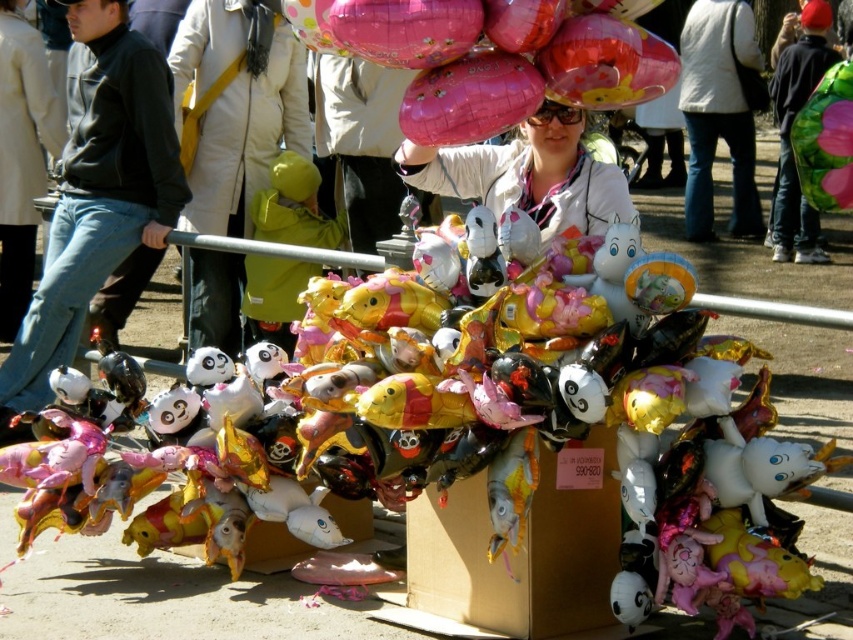
Which of these two, gold cardboard box at center or pink metallic balloon at upper right, stands taller?

Standing taller between the two is pink metallic balloon at upper right.

Does gold cardboard box at center have a larger size compared to pink metallic balloon at upper right?

Incorrect, gold cardboard box at center is not larger than pink metallic balloon at upper right.

The height and width of the screenshot is (640, 853). Describe the element at coordinates (521, 547) in the screenshot. I see `gold cardboard box at center` at that location.

Find the location of a particular element. gold cardboard box at center is located at coordinates (521, 547).

Can you confirm if gold cardboard box at center is smaller than metallic gold balloon at center?

Yes, gold cardboard box at center is smaller than metallic gold balloon at center.

What do you see at coordinates (521, 547) in the screenshot?
I see `gold cardboard box at center` at bounding box center [521, 547].

Locate an element on the screen. The width and height of the screenshot is (853, 640). gold cardboard box at center is located at coordinates (521, 547).

You are a GUI agent. You are given a task and a screenshot of the screen. Output one action in this format:
    pyautogui.click(x=<x>, y=<y>)
    Task: Click on the pink metallic balloons at center
    The width and height of the screenshot is (853, 640).
    Given the screenshot: What is the action you would take?
    pyautogui.click(x=488, y=61)

Is point (386, 42) less distant than point (456, 564)?

Yes.

At what (x,y) coordinates should I click in order to perform the action: click on pink metallic balloons at center. Please return your answer as a coordinate pair (x, y). The height and width of the screenshot is (640, 853). Looking at the image, I should click on pos(488,61).

The height and width of the screenshot is (640, 853). Find the location of `pink metallic balloons at center`. pink metallic balloons at center is located at coordinates (488, 61).